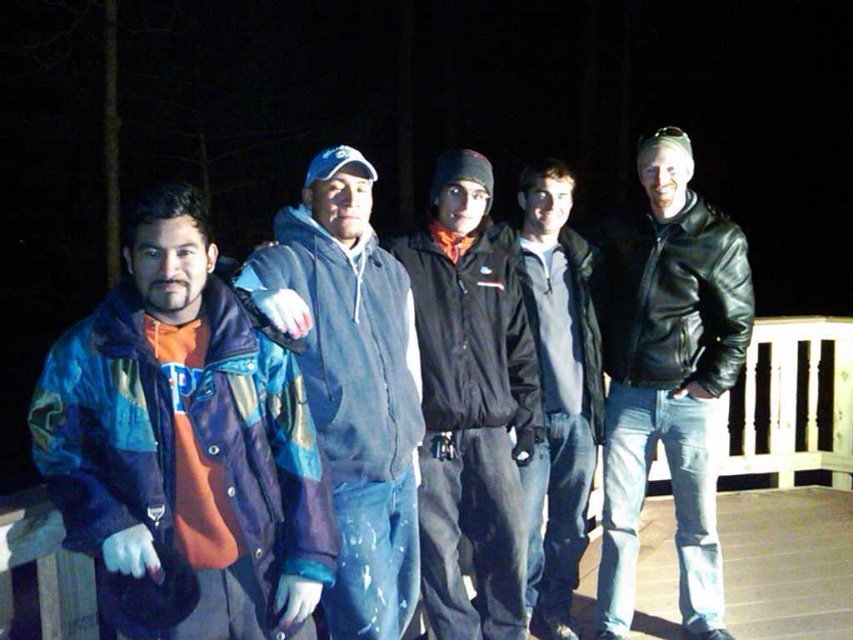
Which is more to the left, dark gray fleece jacket at center or wooden deck at lower center?

dark gray fleece jacket at center

Is point (540, 573) farther from viewer compared to point (851, 637)?

Yes, point (540, 573) is farther from viewer.

Locate an element on the screen. The height and width of the screenshot is (640, 853). dark gray fleece jacket at center is located at coordinates (556, 392).

Which of these two, dark blue fleece jacket at center or wooden deck at lower center, stands taller?

dark blue fleece jacket at center is taller.

Does dark blue fleece jacket at center appear on the right side of wooden deck at lower center?

No, dark blue fleece jacket at center is not to the right of wooden deck at lower center.

Find the location of a particular element. This screenshot has height=640, width=853. dark blue fleece jacket at center is located at coordinates (352, 384).

Who is more forward, [329,544] or [671,144]?

Point [329,544]

Where is `multicolored fabric jacket at left`? Image resolution: width=853 pixels, height=640 pixels. multicolored fabric jacket at left is located at coordinates (186, 438).